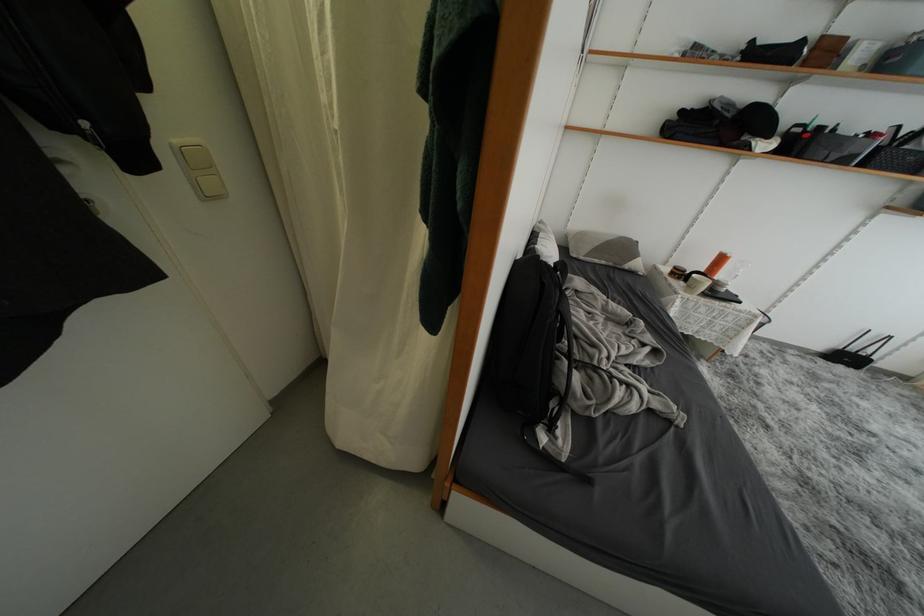
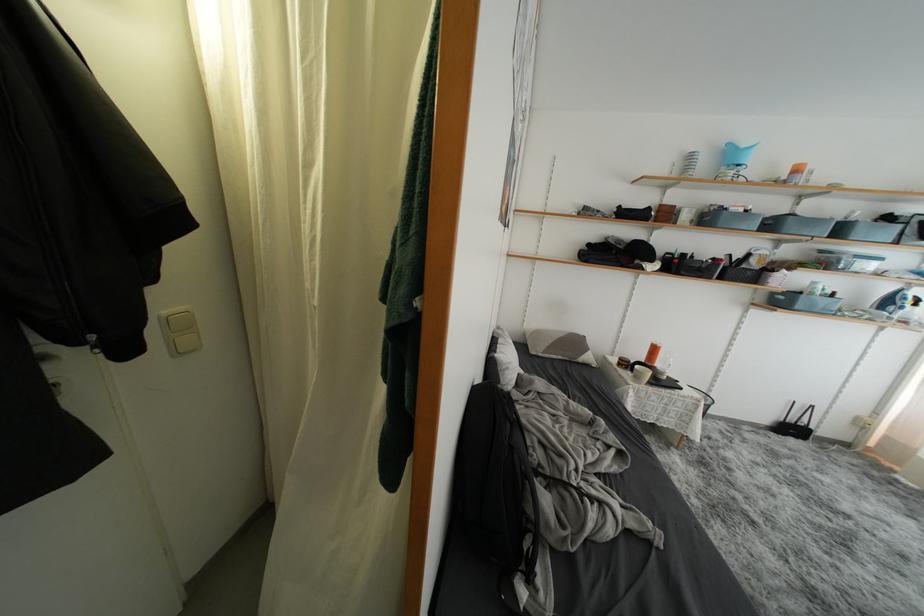
Question: How did the camera likely rotate?

Choices:
 (A) Left
 (B) Right
 (C) Up
 (D) Down

Answer: (C)